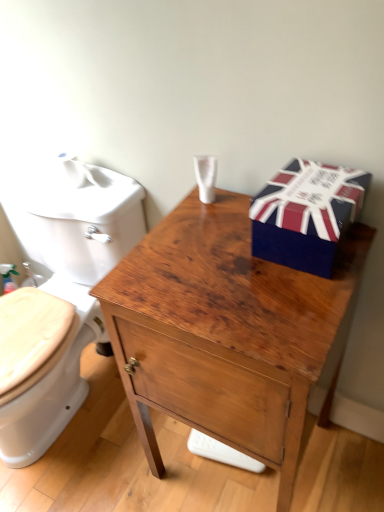
Question: Is white glossy toilet at left turned away from union jack-patterned cardboard box at upper right?

Choices:
 (A) no
 (B) yes

Answer: (A)

Question: Does white glossy toilet at left appear on the right side of union jack-patterned cardboard box at upper right?

Choices:
 (A) no
 (B) yes

Answer: (A)

Question: Is white glossy toilet at left not inside union jack-patterned cardboard box at upper right?

Choices:
 (A) yes
 (B) no

Answer: (A)

Question: Considering the relative positions of white glossy toilet at left and union jack-patterned cardboard box at upper right in the image provided, is white glossy toilet at left in front of union jack-patterned cardboard box at upper right?

Choices:
 (A) yes
 (B) no

Answer: (B)

Question: Considering the relative sizes of white glossy toilet at left and union jack-patterned cardboard box at upper right in the image provided, is white glossy toilet at left taller than union jack-patterned cardboard box at upper right?

Choices:
 (A) no
 (B) yes

Answer: (B)

Question: Looking at the image, does wooden cabinet at center seem bigger or smaller compared to white glossy toilet at left?

Choices:
 (A) big
 (B) small

Answer: (B)

Question: Is point (251, 365) closer or farther from the camera than point (76, 347)?

Choices:
 (A) farther
 (B) closer

Answer: (B)

Question: From a real-world perspective, is wooden cabinet at center positioned above or below white glossy toilet at left?

Choices:
 (A) below
 (B) above

Answer: (B)

Question: Is wooden cabinet at center taller or shorter than white glossy toilet at left?

Choices:
 (A) tall
 (B) short

Answer: (A)

Question: In the image, is union jack-patterned cardboard box at upper right positioned in front of or behind white glossy toilet at left?

Choices:
 (A) front
 (B) behind

Answer: (A)

Question: In terms of width, does union jack-patterned cardboard box at upper right look wider or thinner when compared to white glossy toilet at left?

Choices:
 (A) wide
 (B) thin

Answer: (B)

Question: Is union jack-patterned cardboard box at upper right situated inside white glossy toilet at left or outside?

Choices:
 (A) inside
 (B) outside

Answer: (B)

Question: From the image's perspective, is union jack-patterned cardboard box at upper right above or below white glossy toilet at left?

Choices:
 (A) below
 (B) above

Answer: (B)

Question: In the image, is white glossy toilet at left positioned in front of or behind wooden cabinet at center?

Choices:
 (A) front
 (B) behind

Answer: (B)

Question: From the image's perspective, is white glossy toilet at left above or below wooden cabinet at center?

Choices:
 (A) above
 (B) below

Answer: (A)